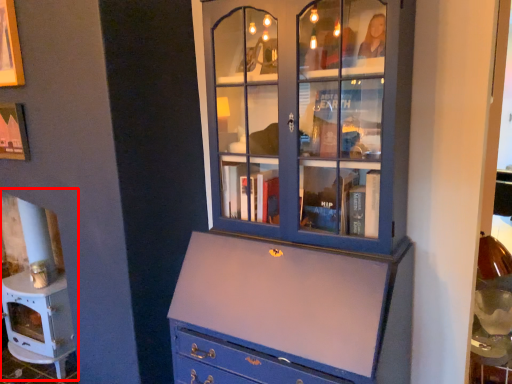
Question: From the image's perspective, what is the correct spatial relationship of fireplace (annotated by the red box) in relation to cupboard?

Choices:
 (A) above
 (B) below

Answer: (B)